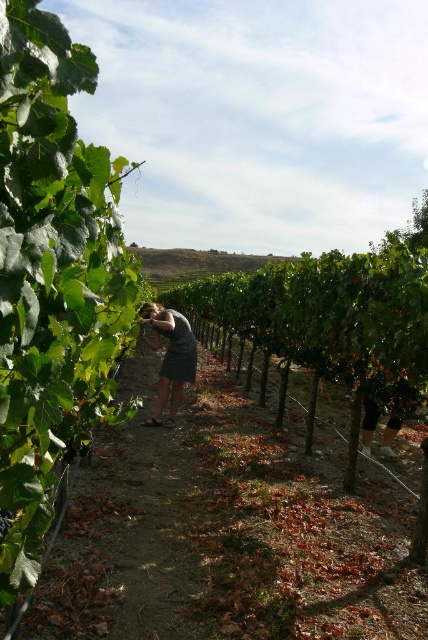
Question: In this image, where is dark gray dress at center located relative to green leafy grape at center-left?

Choices:
 (A) left
 (B) right

Answer: (A)

Question: Which point appears farthest from the camera in this image?

Choices:
 (A) (0, 524)
 (B) (157, 312)

Answer: (B)

Question: Is dark gray dress at center behind green leafy grape at center-left?

Choices:
 (A) no
 (B) yes

Answer: (B)

Question: Which object appears farthest from the camera in this image?

Choices:
 (A) dark gray dress at center
 (B) green leafy grape at center-left

Answer: (A)

Question: Which of the following is the farthest from the observer?

Choices:
 (A) green leafy grape at center-left
 (B) dark gray dress at center

Answer: (B)

Question: Can you confirm if dark gray dress at center is positioned above green leafy grape at center-left?

Choices:
 (A) yes
 (B) no

Answer: (A)